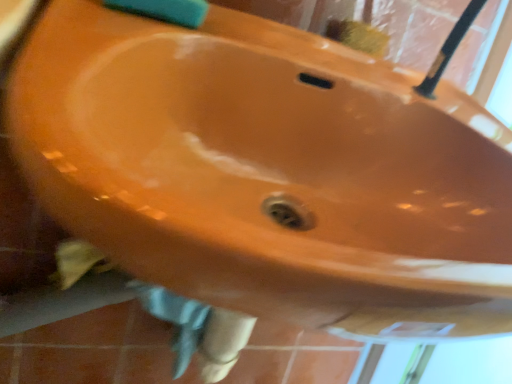
Where is `black plastic faucet at upper right`? This screenshot has width=512, height=384. black plastic faucet at upper right is located at coordinates (449, 49).

Describe the element at coordinates (449, 49) in the screenshot. Image resolution: width=512 pixels, height=384 pixels. I see `black plastic faucet at upper right` at that location.

The image size is (512, 384). In order to click on black plastic faucet at upper right in this screenshot , I will do `click(449, 49)`.